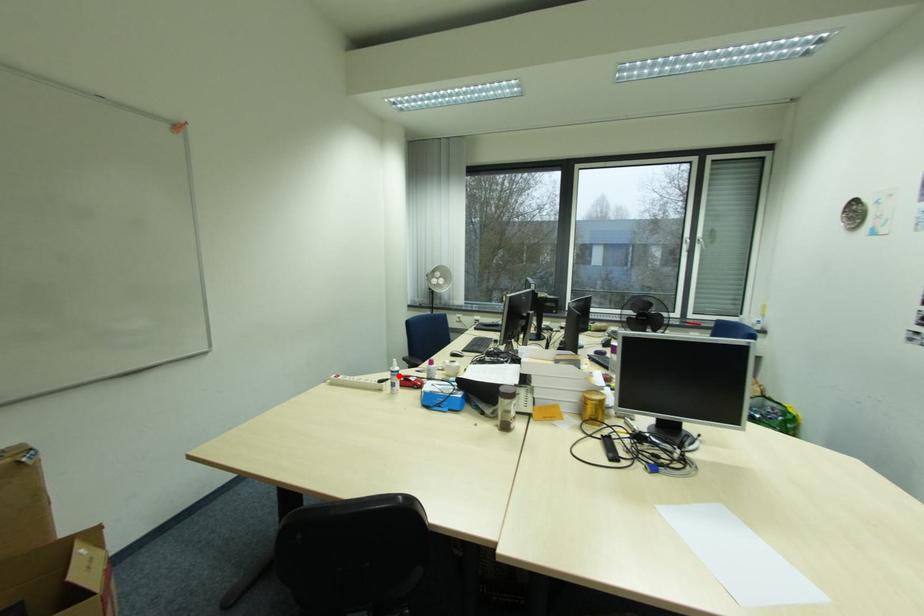
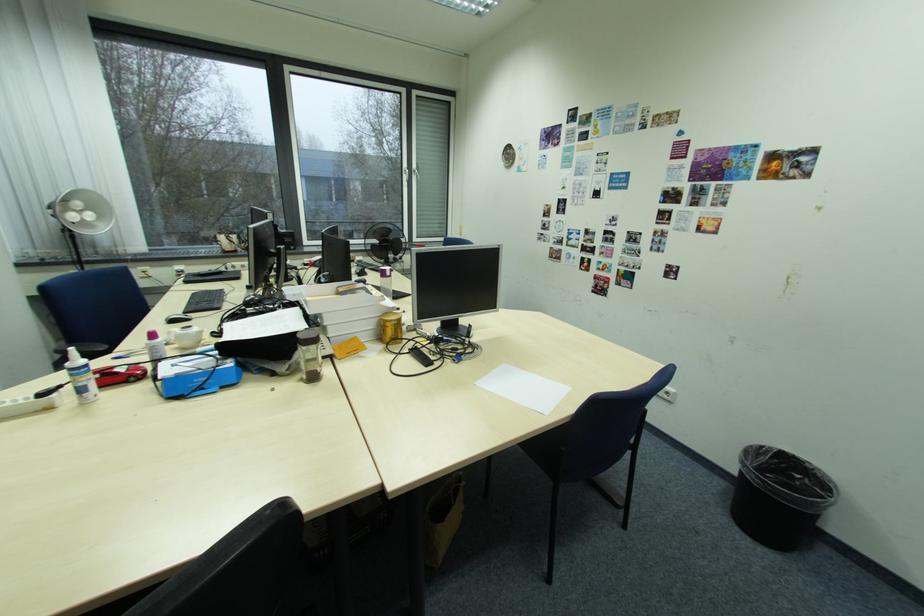
Find the pixel in the second image that matches the highlighted location in the first image.

(80, 376)